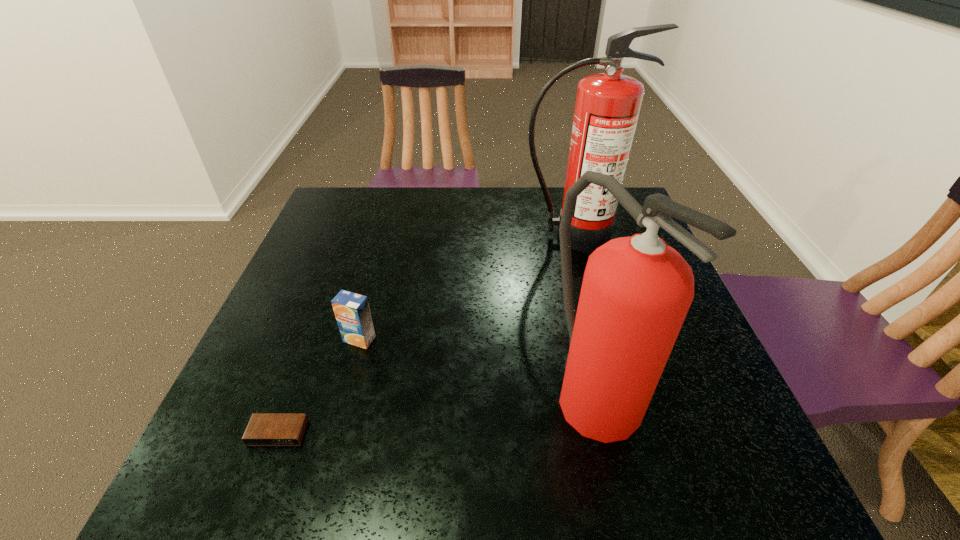
Identify which object is the third nearest to the nearer fire extinguisher. Please provide its 2D coordinates. Your answer should be formatted as a tuple, i.e. [(x, y)], where the tuple contains the x and y coordinates of a point satisfying the conditions above.

[(264, 429)]